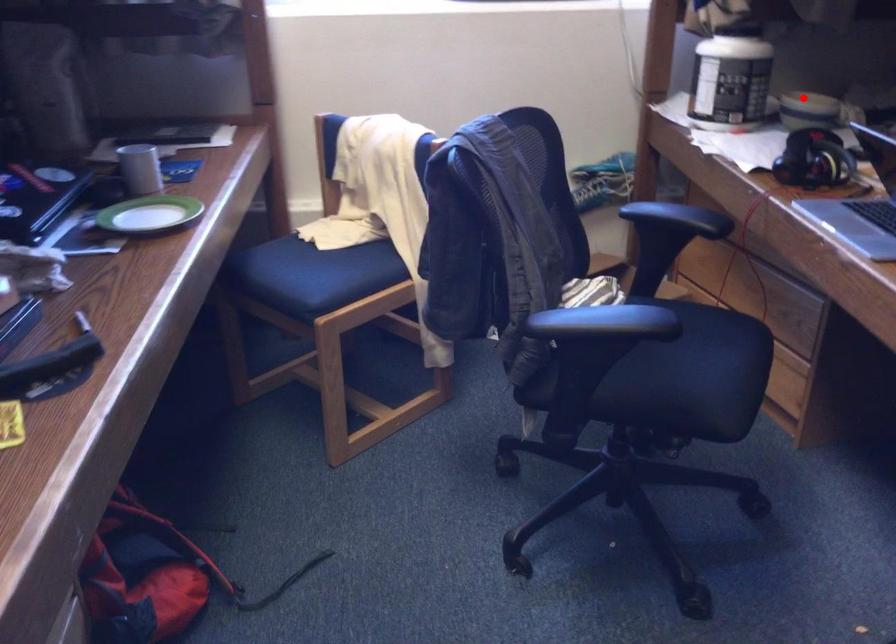
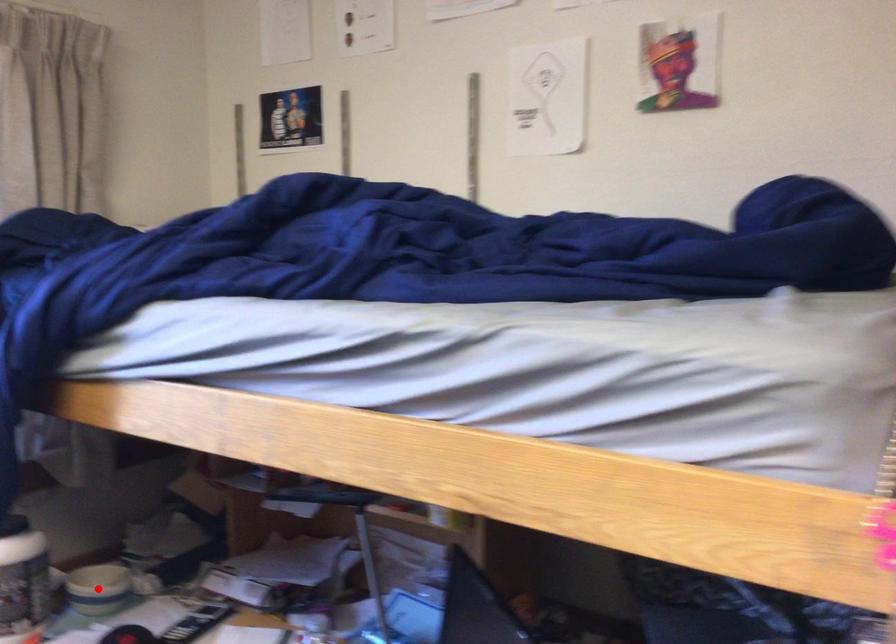
I am providing you with two images of the same scene from different viewpoints. A red point is marked on the first image and another point is marked on the second image. Does the point marked in image1 correspond to the same location as the one in image2?

Yes